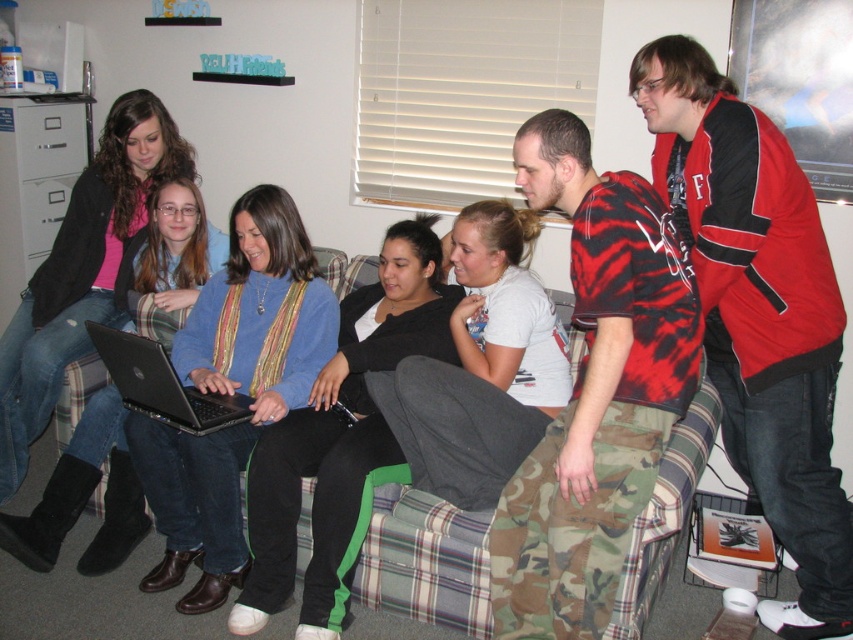
Question: Is red jacket at upper right bigger than red tiger-striped shirt at center?

Choices:
 (A) no
 (B) yes

Answer: (B)

Question: Can you confirm if red tiger-striped shirt at center is smaller than black matte laptop at center?

Choices:
 (A) no
 (B) yes

Answer: (A)

Question: Can you confirm if red tiger-striped shirt at center is positioned to the left of black matte laptop at center?

Choices:
 (A) yes
 (B) no

Answer: (B)

Question: Which point is farther to the camera?

Choices:
 (A) black matte laptop at center
 (B) red tiger-striped shirt at center

Answer: (A)

Question: Which point appears farthest from the camera in this image?

Choices:
 (A) (126, 374)
 (B) (537, 588)

Answer: (A)

Question: Which of these objects is positioned farthest from the red jacket at upper right?

Choices:
 (A) red tiger-striped shirt at center
 (B) black matte laptop at center

Answer: (B)